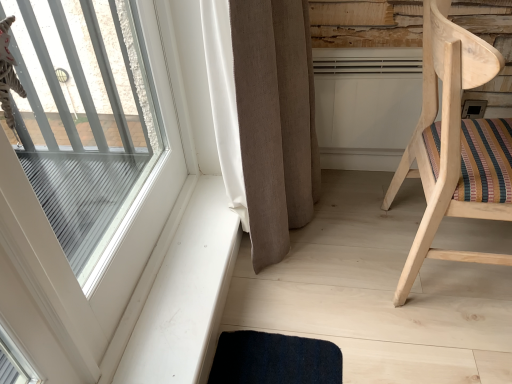
Image resolution: width=512 pixels, height=384 pixels. I want to click on beige fabric curtain at center, so click(x=275, y=121).

From the image's perspective, is natural wood chair at right positioned above or below clear glass window at upper left?

Clearly, from the image's perspective, natural wood chair at right is above clear glass window at upper left.

Could you tell me if natural wood chair at right is turned towards clear glass window at upper left?

No, natural wood chair at right is not aimed at clear glass window at upper left.

Does natural wood chair at right contain clear glass window at upper left?

Definitely not — clear glass window at upper left is not inside natural wood chair at right.

Is white smooth window sill at lower left not within natural wood chair at right?

white smooth window sill at lower left is positioned outside natural wood chair at right.

The image size is (512, 384). Identify the location of chair above the white smooth window sill at lower left (from the image's perspective). (454, 145).

Which of these two, white smooth window sill at lower left or natural wood chair at right, is thinner?

Thinner between the two is white smooth window sill at lower left.

Is natural wood chair at right positioned before beige fabric curtain at center?

Yes, the depth of natural wood chair at right is less than that of beige fabric curtain at center.

Is beige fabric curtain at center at the back of natural wood chair at right?

That's right, natural wood chair at right is facing away from beige fabric curtain at center.

From the image's perspective, is natural wood chair at right located above or below beige fabric curtain at center?

natural wood chair at right is below beige fabric curtain at center.

Does natural wood chair at right appear on the right side of beige fabric curtain at center?

Yes.

Can you confirm if beige fabric curtain at center is wider than white smooth window sill at lower left?

Correct, the width of beige fabric curtain at center exceeds that of white smooth window sill at lower left.

Considering the relative sizes of beige fabric curtain at center and white smooth window sill at lower left in the image provided, is beige fabric curtain at center taller than white smooth window sill at lower left?

Indeed, beige fabric curtain at center has a greater height compared to white smooth window sill at lower left.

From the image's perspective, which one is positioned higher, beige fabric curtain at center or white smooth window sill at lower left?

beige fabric curtain at center is shown above in the image.

From a real-world perspective, does beige fabric curtain at center sit lower than white smooth window sill at lower left?

No, from a real-world perspective, beige fabric curtain at center is not under white smooth window sill at lower left.

Would you say natural wood chair at right is a long distance from white smooth window sill at lower left?

No, natural wood chair at right is not far away from white smooth window sill at lower left.

Considering the sizes of natural wood chair at right and white smooth window sill at lower left in the image, is natural wood chair at right wider or thinner than white smooth window sill at lower left?

Considering their sizes, natural wood chair at right looks broader than white smooth window sill at lower left.

Is white smooth window sill at lower left located within natural wood chair at right?

Definitely not — white smooth window sill at lower left is not inside natural wood chair at right.

How much distance is there between natural wood chair at right and white smooth window sill at lower left?

They are 28.84 inches apart.

From the image's perspective, is white smooth window sill at lower left located above clear glass window at upper left?

No, from the image's perspective, white smooth window sill at lower left is not on top of clear glass window at upper left.

Considering the relative sizes of white smooth window sill at lower left and clear glass window at upper left in the image provided, is white smooth window sill at lower left bigger than clear glass window at upper left?

Actually, white smooth window sill at lower left might be smaller than clear glass window at upper left.

What are the coordinates of `window above the white smooth window sill at lower left (from the image's perspective)` in the screenshot? It's located at tap(66, 258).

Looking at their sizes, would you say white smooth window sill at lower left is wider or thinner than clear glass window at upper left?

Considering their sizes, white smooth window sill at lower left looks broader than clear glass window at upper left.

Can beige fabric curtain at center be found inside clear glass window at upper left?

No.

Considering the sizes of objects clear glass window at upper left and beige fabric curtain at center in the image provided, who is wider, clear glass window at upper left or beige fabric curtain at center?

Wider between the two is beige fabric curtain at center.

Considering the relative sizes of clear glass window at upper left and beige fabric curtain at center in the image provided, is clear glass window at upper left taller than beige fabric curtain at center?

No, clear glass window at upper left is not taller than beige fabric curtain at center.

Which object is further away from the camera, clear glass window at upper left or beige fabric curtain at center?

beige fabric curtain at center is further from the camera.

Image resolution: width=512 pixels, height=384 pixels. Identify the location of chair beneath the clear glass window at upper left (from a real-world perspective). (454, 145).

Image resolution: width=512 pixels, height=384 pixels. I want to click on window sill on the left side of natural wood chair at right, so click(x=179, y=292).

Considering their positions, is beige fabric curtain at center positioned closer to white smooth window sill at lower left than clear glass window at upper left?

The object closer to white smooth window sill at lower left is clear glass window at upper left.

Which object lies nearer to the anchor point white smooth window sill at lower left, clear glass window at upper left or natural wood chair at right?

Among the two, clear glass window at upper left is located nearer to white smooth window sill at lower left.

Based on their spatial positions, is beige fabric curtain at center or clear glass window at upper left further from natural wood chair at right?

clear glass window at upper left is positioned further to the anchor natural wood chair at right.

From the image, which object appears to be nearer to white smooth window sill at lower left, natural wood chair at right or beige fabric curtain at center?

Among the two, beige fabric curtain at center is located nearer to white smooth window sill at lower left.

Looking at the image, which one is located closer to white smooth window sill at lower left, clear glass window at upper left or beige fabric curtain at center?

clear glass window at upper left is closer to white smooth window sill at lower left.

From the picture: Which object lies further to the anchor point clear glass window at upper left, white smooth window sill at lower left or natural wood chair at right?

natural wood chair at right is further to clear glass window at upper left.

From the image, which object appears to be farther from clear glass window at upper left, beige fabric curtain at center or natural wood chair at right?

natural wood chair at right lies further to clear glass window at upper left than the other object.

In the scene shown: Based on their spatial positions, is clear glass window at upper left or white smooth window sill at lower left further from natural wood chair at right?

The object further to natural wood chair at right is clear glass window at upper left.

The width and height of the screenshot is (512, 384). I want to click on curtain between white smooth window sill at lower left and natural wood chair at right from left to right, so click(275, 121).

Locate an element on the screen. curtain between clear glass window at upper left and natural wood chair at right from left to right is located at coordinates (275, 121).

Where is `window sill situated between clear glass window at upper left and natural wood chair at right from left to right`? The height and width of the screenshot is (384, 512). window sill situated between clear glass window at upper left and natural wood chair at right from left to right is located at coordinates (179, 292).

What are the coordinates of `curtain between clear glass window at upper left and white smooth window sill at lower left in the front-back direction` in the screenshot? It's located at (275, 121).